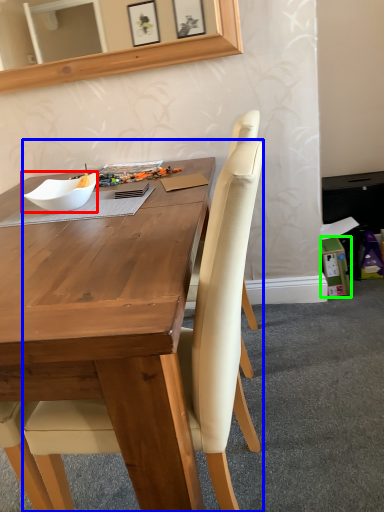
Question: Which object is the farthest from bowl (highlighted by a red box)? Choose among these: chair (highlighted by a blue box) or box (highlighted by a green box).

Choices:
 (A) chair
 (B) box

Answer: (B)